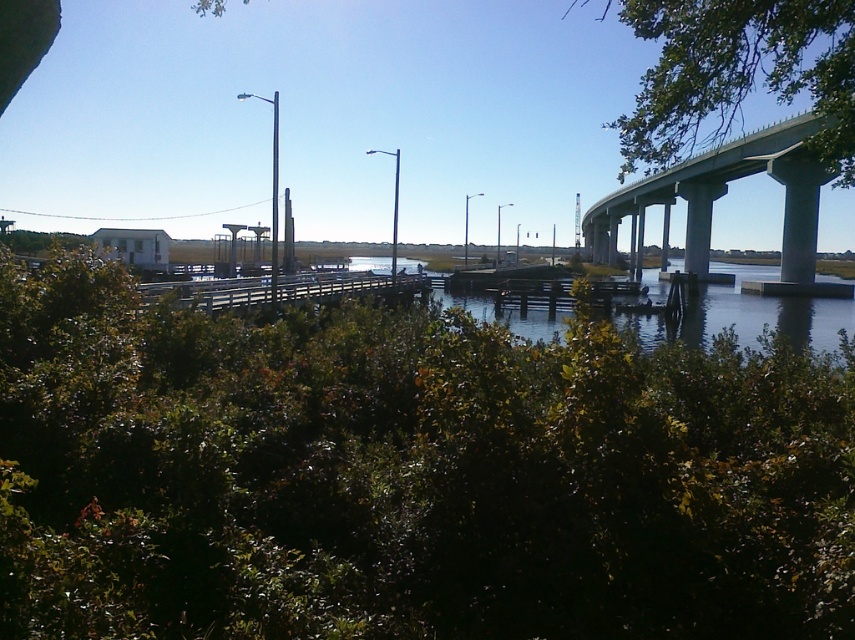
Question: Is green leafy shrubs at lower center thinner than wooden dock at center?

Choices:
 (A) no
 (B) yes

Answer: (B)

Question: Can you confirm if green leafy shrubs at lower center is thinner than wooden dock at center?

Choices:
 (A) no
 (B) yes

Answer: (B)

Question: Which point is closer to the camera taking this photo?

Choices:
 (A) (682, 138)
 (B) (765, 545)
 (C) (800, 228)

Answer: (B)

Question: Which of the following is the farthest from the observer?

Choices:
 (A) wooden dock at center
 (B) green leafy shrubs at lower center
 (C) gray concrete overpass at upper right
 (D) green leafy tree at upper right

Answer: (C)

Question: Does green leafy tree at upper right have a lesser width compared to wooden dock at center?

Choices:
 (A) no
 (B) yes

Answer: (A)

Question: Which point is farther from the camera taking this photo?

Choices:
 (A) (628, 138)
 (B) (357, 289)
 (C) (812, 202)
 (D) (115, 300)

Answer: (C)